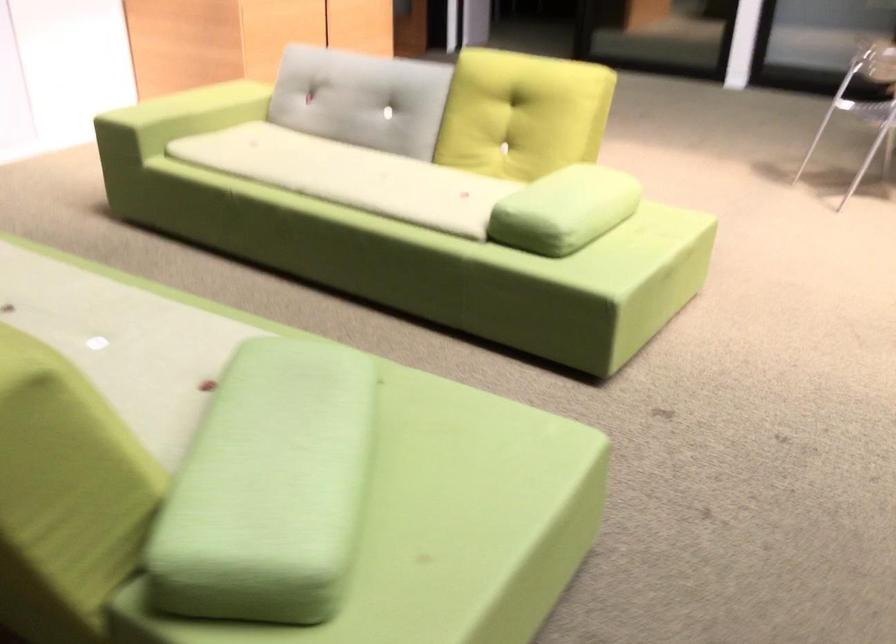
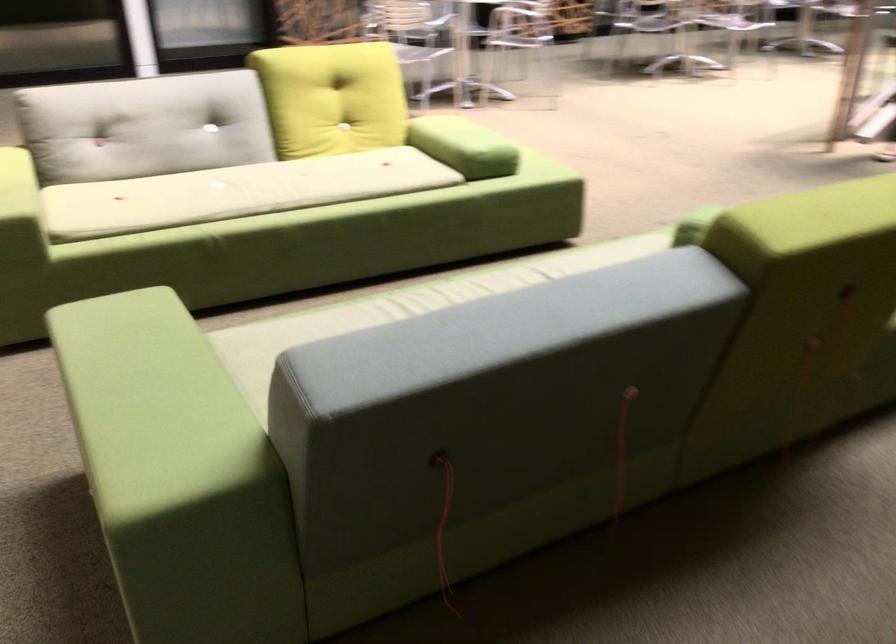
Locate, in the second image, the point that corresponds to pixel 302 163 in the first image.

(236, 192)